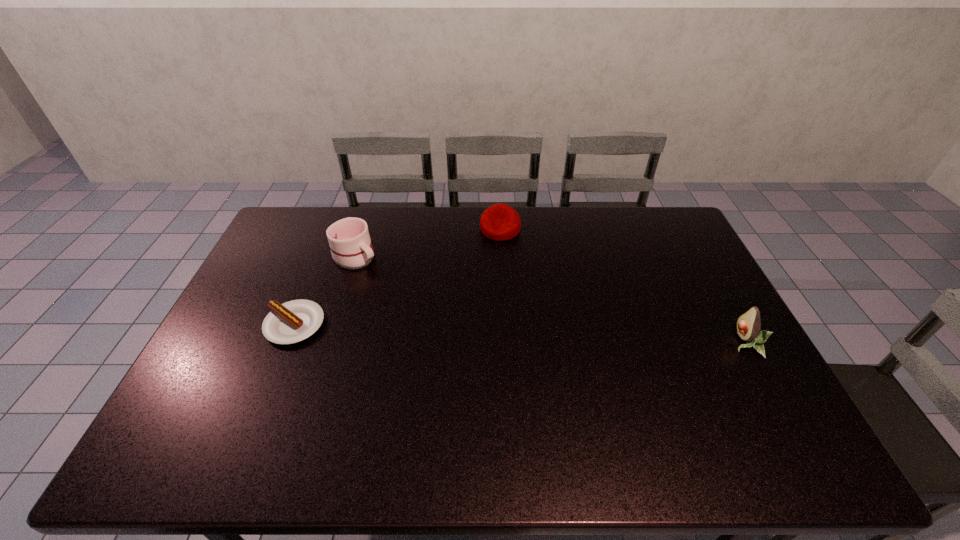
At what (x,y) coordinates should I click in order to perform the action: click on the shortest object. Please return your answer as a coordinate pair (x, y). This screenshot has height=540, width=960. Looking at the image, I should click on (291, 322).

Locate an element on the screen. This screenshot has height=540, width=960. the rightmost object is located at coordinates (749, 323).

I want to click on beanbag, so click(499, 222).

In order to click on the third tallest object in this screenshot , I will do `click(499, 222)`.

Find the location of a particular element. The image size is (960, 540). mug is located at coordinates (349, 240).

Locate an element on the screen. The image size is (960, 540). free space located 0.120m on the front of the shortest object is located at coordinates (271, 384).

This screenshot has height=540, width=960. Identify the location of free region located on the seed side of the rightmost object. pyautogui.click(x=639, y=343).

You are a GUI agent. You are given a task and a screenshot of the screen. Output one action in this format:
    pyautogui.click(x=<x>, y=<y>)
    Task: Click on the vacant point located on the seed side of the rightmost object
    Image resolution: width=960 pixels, height=540 pixels.
    Given the screenshot: What is the action you would take?
    coord(663,343)

Identify the location of vacant area located 0.150m on the seed side of the rightmost object. The width and height of the screenshot is (960, 540). (682, 343).

Find the location of a particular element. The width and height of the screenshot is (960, 540). free spot located on the seat area of the second object from right to left is located at coordinates (499, 280).